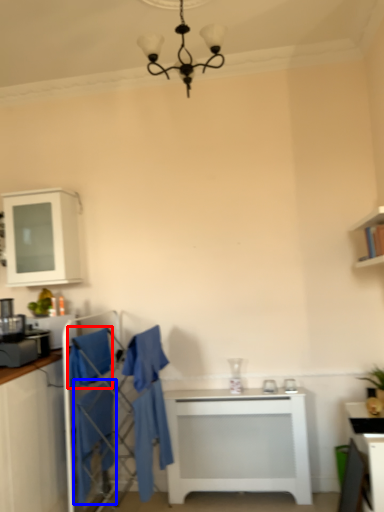
Question: Which point is further to the camera, robe (highlighted by a red box) or robe (highlighted by a blue box)?

Choices:
 (A) robe
 (B) robe

Answer: (A)